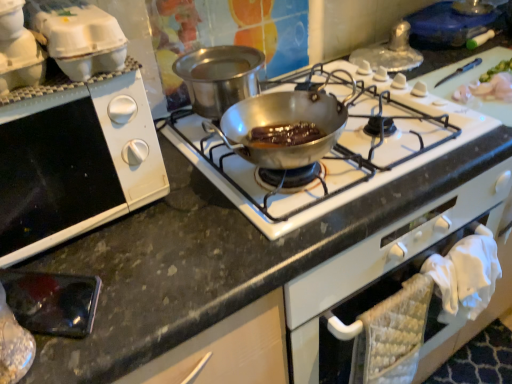
The width and height of the screenshot is (512, 384). What do you see at coordinates (77, 167) in the screenshot? I see `white matte oven at left` at bounding box center [77, 167].

The width and height of the screenshot is (512, 384). What do you see at coordinates (18, 50) in the screenshot?
I see `white plastic egg carton at upper left` at bounding box center [18, 50].

Measure the distance between white plastic egg carton at upper left and camera.

They are 20.38 inches apart.

Measure the distance between stainless steel pan at center and camera.

stainless steel pan at center and camera are 32.49 inches apart.

What do you see at coordinates (336, 156) in the screenshot? I see `shiny silver pan at center` at bounding box center [336, 156].

I want to click on white matte oven at left, so click(x=77, y=167).

From a real-world perspective, is stainless steel pan at center above or below white cardboard egg carton at upper left?

From a real-world perspective, stainless steel pan at center is physically below white cardboard egg carton at upper left.

Is white cardboard egg carton at upper left a part of stainless steel pan at center?

No, white cardboard egg carton at upper left is not surrounded by stainless steel pan at center.

Which is more to the left, stainless steel pan at center or white cardboard egg carton at upper left?

white cardboard egg carton at upper left.

How many degrees apart are the facing directions of stainless steel pan at center and white cardboard egg carton at upper left?

0.763 degrees.

Considering the relative sizes of stainless steel pan at center and shiny silver pan at center in the image provided, is stainless steel pan at center taller than shiny silver pan at center?

Yes, stainless steel pan at center is taller than shiny silver pan at center.

Is stainless steel pan at center surrounding shiny silver pan at center?

No, shiny silver pan at center is located outside of stainless steel pan at center.

Which is less distant, (x=242, y=98) or (x=406, y=105)?

Point (x=242, y=98) is closer to the camera than point (x=406, y=105).

In the image, there is a stainless steel pan at center. Where is `kitchen appliance below it (from the image's perspective)`? This screenshot has width=512, height=384. kitchen appliance below it (from the image's perspective) is located at coordinates (18, 50).

From a real-world perspective, does white plastic egg carton at upper left stand above stainless steel pan at center?

Yes, from a real-world perspective, white plastic egg carton at upper left is above stainless steel pan at center.

Considering the points (27, 43) and (193, 56), which point is behind, point (27, 43) or point (193, 56)?

The point (193, 56) is farther.

Is white plastic egg carton at upper left positioned beyond the bounds of stainless steel pan at center?

Yes, white plastic egg carton at upper left is not within stainless steel pan at center.

Is point (28, 193) closer to camera compared to point (264, 192)?

Yes, it is.

Between white matte oven at left and shiny silver pan at center, which one appears on the left side from the viewer's perspective?

white matte oven at left is more to the left.

Is point (126, 193) farther from viewer compared to point (212, 81)?

No, it is in front of (212, 81).

Looking at this image, considering the sizes of white matte oven at left and stainless steel pan at center in the image, is white matte oven at left taller or shorter than stainless steel pan at center?

Considering their sizes, white matte oven at left has more height than stainless steel pan at center.

Identify the location of pot/pan below the white matte oven at left (from a real-world perspective). (219, 77).

Is shiny silver pan at center turned away from white plastic egg carton at upper left?

No, white plastic egg carton at upper left is not at the back of shiny silver pan at center.

Which object is more forward, shiny silver pan at center or white plastic egg carton at upper left?

Positioned in front is white plastic egg carton at upper left.

Which object is positioned more to the right, shiny silver pan at center or white plastic egg carton at upper left?

From the viewer's perspective, shiny silver pan at center appears more on the right side.

Locate an element on the screen. The image size is (512, 384). kitchen appliance on the left of shiny silver pan at center is located at coordinates (18, 50).

Is white matte oven at left facing away from white plastic egg carton at upper left?

No, white matte oven at left's orientation is not away from white plastic egg carton at upper left.

From the picture: Can you confirm if white matte oven at left is wider than white plastic egg carton at upper left?

Correct, the width of white matte oven at left exceeds that of white plastic egg carton at upper left.

From the image's perspective, would you say white matte oven at left is positioned over white plastic egg carton at upper left?

Actually, white matte oven at left appears below white plastic egg carton at upper left in the image.

Locate an element on the screen. kitchen appliance on the left of white matte oven at left is located at coordinates (18, 50).

I want to click on pot/pan located behind the white cardboard egg carton at upper left, so click(219, 77).

The height and width of the screenshot is (384, 512). I want to click on pot/pan on the left of shiny silver pan at center, so click(219, 77).

Consider the image. Considering their positions, is white plastic egg carton at upper left positioned further to white cardboard egg carton at upper left than stainless steel pan at center?

stainless steel pan at center lies further to white cardboard egg carton at upper left than the other object.

From the image, which object appears to be farther from shiny silver pan at center, stainless steel pan at center or white matte oven at left?

white matte oven at left is positioned further to the anchor shiny silver pan at center.

When comparing their distances from white matte oven at left, does shiny silver pan at center or white cardboard egg carton at upper left seem closer?

Based on the image, white cardboard egg carton at upper left appears to be nearer to white matte oven at left.

In the scene shown: Considering their positions, is stainless steel pan at center positioned closer to white matte oven at left than shiny silver pan at center?

stainless steel pan at center.

Looking at the image, which one is located further to white plastic egg carton at upper left, white cardboard egg carton at upper left or stainless steel pan at center?

stainless steel pan at center lies further to white plastic egg carton at upper left than the other object.

Estimate the real-world distances between objects in this image. Which object is further from white matte oven at left, white plastic egg carton at upper left or white cardboard egg carton at upper left?

white plastic egg carton at upper left.

Which object lies nearer to the anchor point shiny silver pan at center, white plastic egg carton at upper left or white cardboard egg carton at upper left?

Based on the image, white cardboard egg carton at upper left appears to be nearer to shiny silver pan at center.

Looking at the image, which one is located closer to white cardboard egg carton at upper left, shiny silver pan at center or stainless steel pan at center?

stainless steel pan at center is closer to white cardboard egg carton at upper left.

The height and width of the screenshot is (384, 512). I want to click on appliance between white plastic egg carton at upper left and stainless steel pan at center in the horizontal direction, so click(x=79, y=37).

Where is `oven between white plastic egg carton at upper left and shiny silver pan at center from left to right`? This screenshot has height=384, width=512. oven between white plastic egg carton at upper left and shiny silver pan at center from left to right is located at coordinates (77, 167).

Identify the location of appliance between white matte oven at left and stainless steel pan at center from front to back. The width and height of the screenshot is (512, 384). (79, 37).

Locate an element on the screen. The width and height of the screenshot is (512, 384). appliance between white matte oven at left and shiny silver pan at center in the horizontal direction is located at coordinates (79, 37).